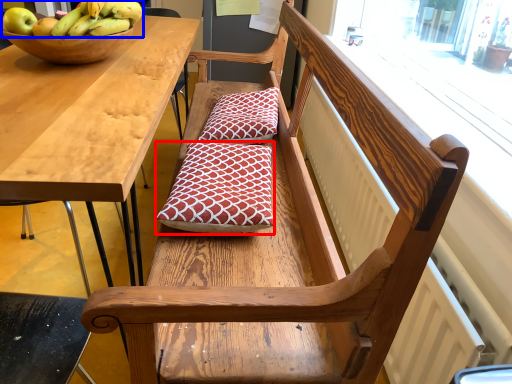
Question: Which of the following is the closest to the observer, pillow (highlighted by a red box) or banana (highlighted by a blue box)?

Choices:
 (A) pillow
 (B) banana

Answer: (B)